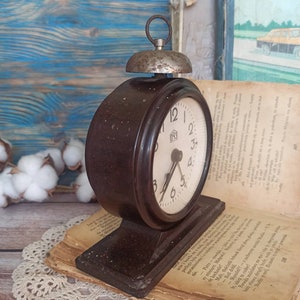
I want to click on painting, so (259, 37).